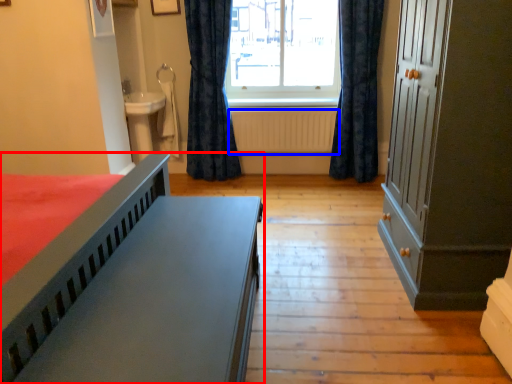
Question: Which point is closer to the camera, bed (highlighted by a red box) or radiator (highlighted by a blue box)?

Choices:
 (A) bed
 (B) radiator

Answer: (A)